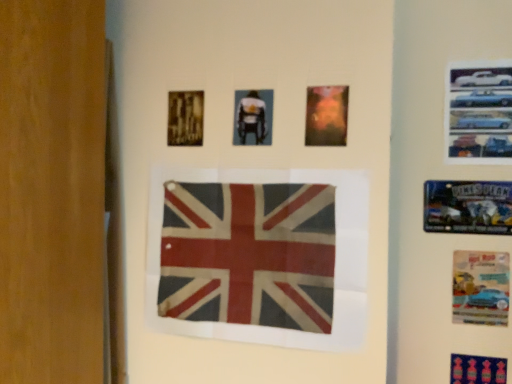
Question: Is rusty fabric flag at center oriented away from blue fabric poster at lower right, positioned as the fourth poster in right-to-left order?

Choices:
 (A) no
 (B) yes

Answer: (A)

Question: Is rusty fabric flag at center wider than blue fabric poster at lower right, positioned as the fourth poster in right-to-left order?

Choices:
 (A) yes
 (B) no

Answer: (B)

Question: From a real-world perspective, is rusty fabric flag at center over blue fabric poster at lower right, marked as the 7th poster in a top-to-bottom arrangement?

Choices:
 (A) no
 (B) yes

Answer: (B)

Question: Considering the relative sizes of rusty fabric flag at center and blue fabric poster at lower right, which is counted as the first poster, starting from the bottom, in the image provided, is rusty fabric flag at center smaller than blue fabric poster at lower right, which is counted as the first poster, starting from the bottom,?

Choices:
 (A) yes
 (B) no

Answer: (B)

Question: From the image's perspective, is rusty fabric flag at center above blue fabric poster at lower right, which is counted as the first poster, starting from the bottom?

Choices:
 (A) no
 (B) yes

Answer: (B)

Question: In the image, is rusty fabric flag at center positioned in front of or behind metallic cars at upper right, marked as the first poster in a right-to-left arrangement?

Choices:
 (A) behind
 (B) front

Answer: (B)

Question: Looking at the image, does rusty fabric flag at center seem bigger or smaller compared to metallic cars at upper right, marked as the first poster in a right-to-left arrangement?

Choices:
 (A) small
 (B) big

Answer: (B)

Question: In terms of width, does rusty fabric flag at center look wider or thinner when compared to metallic cars at upper right, which is counted as the 7th poster, starting from the bottom?

Choices:
 (A) wide
 (B) thin

Answer: (A)

Question: From the image's perspective, is rusty fabric flag at center located above or below metallic cars at upper right, the 7th poster positioned from the left?

Choices:
 (A) above
 (B) below

Answer: (B)

Question: In the image, is rusty fabric flag at center positioned in front of or behind metallic blue poster at upper right, the 3th poster when ordered from bottom to top?

Choices:
 (A) behind
 (B) front

Answer: (B)

Question: Is rusty fabric flag at center taller or shorter than metallic blue poster at upper right, the sixth poster from the left?

Choices:
 (A) short
 (B) tall

Answer: (B)

Question: Which is correct: rusty fabric flag at center is inside metallic blue poster at upper right, the 3th poster when ordered from bottom to top, or outside of it?

Choices:
 (A) inside
 (B) outside

Answer: (B)

Question: From the image's perspective, is rusty fabric flag at center located above or below metallic blue poster at upper right, the 3th poster when ordered from bottom to top?

Choices:
 (A) below
 (B) above

Answer: (A)

Question: Is point (333, 86) closer or farther from the camera than point (485, 230)?

Choices:
 (A) farther
 (B) closer

Answer: (B)

Question: From the image's perspective, is matte orange poster at upper center, the fourth poster positioned from the top, above or below metallic blue poster at upper right, the 3th poster when ordered from bottom to top?

Choices:
 (A) above
 (B) below

Answer: (A)